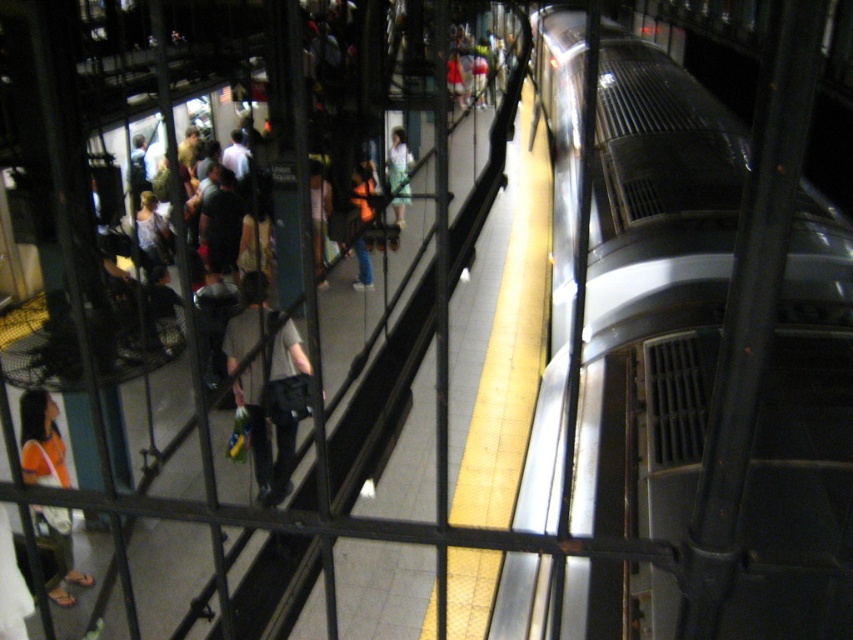
Does dark gray fabric bag at center have a smaller size compared to orange fabric shirt at lower left?

Incorrect, dark gray fabric bag at center is not smaller in size than orange fabric shirt at lower left.

Which is more to the right, dark gray fabric bag at center or orange fabric shirt at lower left?

From the viewer's perspective, dark gray fabric bag at center appears more on the right side.

Between point (280, 387) and point (32, 422), which one is positioned behind?

The point (280, 387) is behind.

The height and width of the screenshot is (640, 853). What are the coordinates of `dark gray fabric bag at center` in the screenshot? It's located at (276, 410).

Who is taller, silver metallic train at right or dark gray fabric bag at center?

With more height is silver metallic train at right.

Between silver metallic train at right and dark gray fabric bag at center, which one appears on the left side from the viewer's perspective?

dark gray fabric bag at center is more to the left.

Is point (631, 605) farther from camera compared to point (276, 493)?

No, it is not.

Identify the location of silver metallic train at right. The height and width of the screenshot is (640, 853). (717, 348).

Between silver metallic train at right and light blue fabric dress at center, which one appears on the left side from the viewer's perspective?

Positioned to the left is light blue fabric dress at center.

Who is shorter, silver metallic train at right or light blue fabric dress at center?

With less height is light blue fabric dress at center.

Which is behind, point (697, 406) or point (407, 179)?

The point (407, 179) is behind.

This screenshot has width=853, height=640. In order to click on silver metallic train at right in this screenshot , I will do `click(717, 348)`.